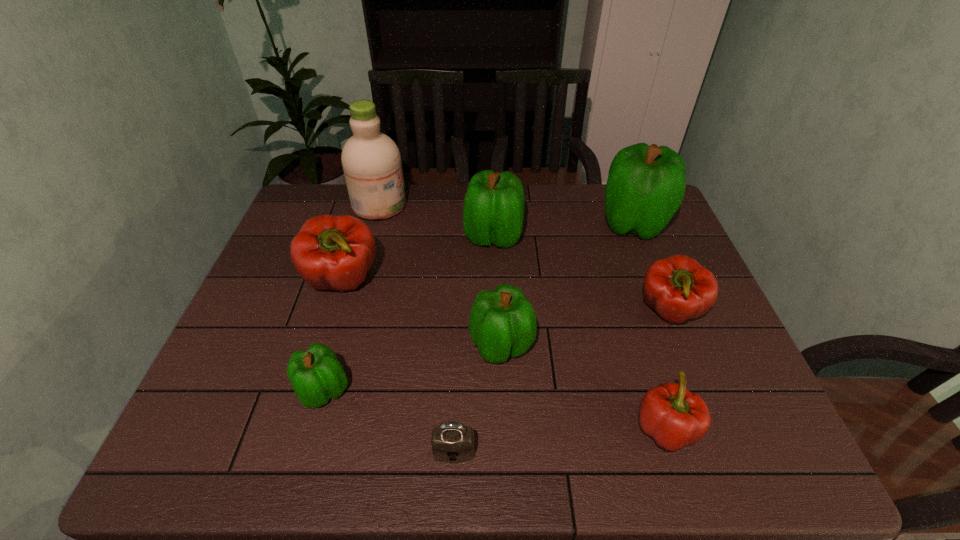
You are a GUI agent. You are given a task and a screenshot of the screen. Output one action in this format:
    pyautogui.click(x=<x>, y=<y>)
    Task: Click on the cleansing agent
    
    Given the screenshot: What is the action you would take?
    pyautogui.click(x=371, y=161)

Find the location of `the rightmost green bell pepper`. the rightmost green bell pepper is located at coordinates (646, 184).

Locate an element on the screen. This screenshot has height=540, width=960. the biggest green bell pepper is located at coordinates (646, 184).

You are a GUI agent. You are given a task and a screenshot of the screen. Output one action in this format:
    pyautogui.click(x=<x>, y=<y>)
    Task: Click on the second biggest green bell pepper
    This screenshot has height=540, width=960.
    Given the screenshot: What is the action you would take?
    pyautogui.click(x=493, y=211)

This screenshot has width=960, height=540. Identify the location of the biggest pink bell pepper. (330, 252).

Where is `the second smallest green bell pepper`? the second smallest green bell pepper is located at coordinates (502, 323).

You are a GUI agent. You are given a task and a screenshot of the screen. Output one action in this format:
    pyautogui.click(x=<x>, y=<y>)
    Task: Click on the second smallest pink bell pepper
    The height and width of the screenshot is (540, 960).
    Given the screenshot: What is the action you would take?
    pyautogui.click(x=678, y=288)

Find the location of a particular element. This screenshot has height=540, width=960. the smallest green bell pepper is located at coordinates pos(316,375).

The image size is (960, 540). Identify the location of the nearest pink bell pepper. (673, 416).

This screenshot has height=540, width=960. Identify the location of padlock. (452, 442).